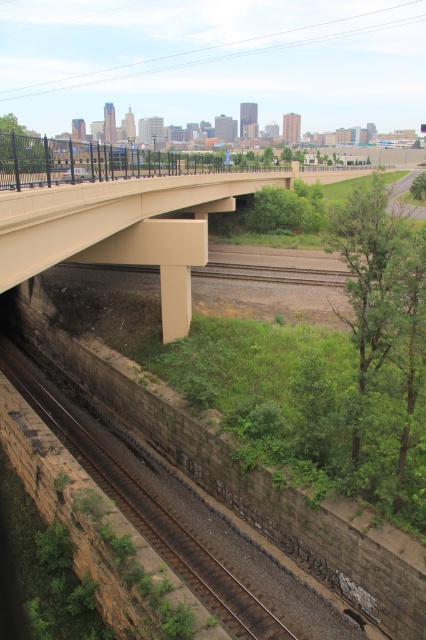
You are standing at the center of the railway tracks and want to walk towards the green leafy tree at right. Which direction should you head?

The green leafy tree at right is located at point 0.422 on the x axis and 0.862 on the y axis. Since you are at the center of the railway tracks, you should head towards the right and forward direction to reach it.